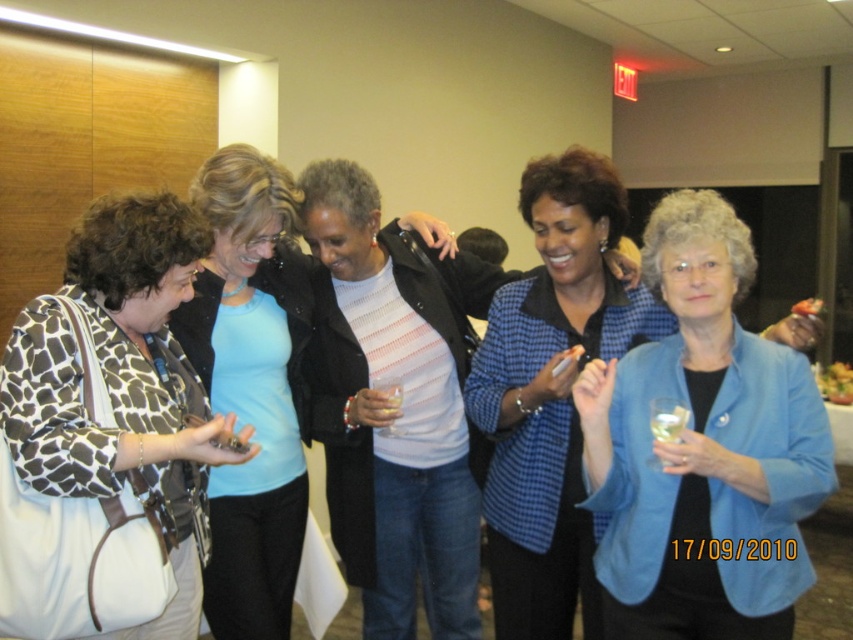
Measure the distance from light blue shirt at center to translucent glass at center.

light blue shirt at center is 37.95 inches from translucent glass at center.

Between light blue shirt at center and translucent glass at center, which one is positioned lower?

translucent glass at center is lower down.

Is point (259, 573) less distant than point (659, 400)?

No, it is behind (659, 400).

The height and width of the screenshot is (640, 853). Find the location of `light blue shirt at center`. light blue shirt at center is located at coordinates point(252,387).

Can you confirm if translucent glass at center is taller than translucent plastic cup at center?

Correct, translucent glass at center is much taller as translucent plastic cup at center.

Is point (663, 417) more distant than point (389, 401)?

No, (663, 417) is closer to viewer.

Which is in front, point (682, 419) or point (381, 412)?

Point (682, 419)

The image size is (853, 640). Identify the location of translucent glass at center. (666, 419).

Who is more distant from viewer, (762, 568) or (664, 465)?

The point (762, 568) is more distant.

Which is below, blue fabric jacket at right or translucent glass at center?

Positioned lower is translucent glass at center.

Which is behind, point (657, 602) or point (666, 422)?

Point (657, 602)

Find the location of `blue fabric jacket at right`. blue fabric jacket at right is located at coordinates (703, 449).